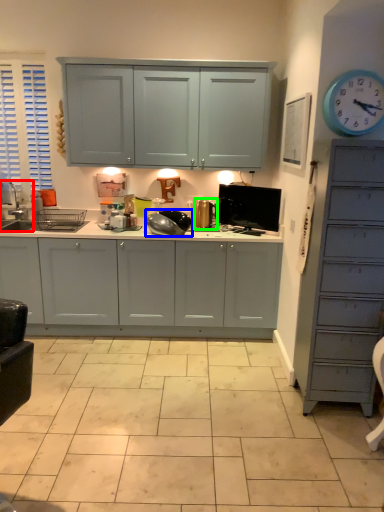
Question: Which object is positioned closest to sink (highlighted by a red box)? Select from appliance (highlighted by a blue box) and appliance (highlighted by a green box).

Choices:
 (A) appliance
 (B) appliance

Answer: (A)